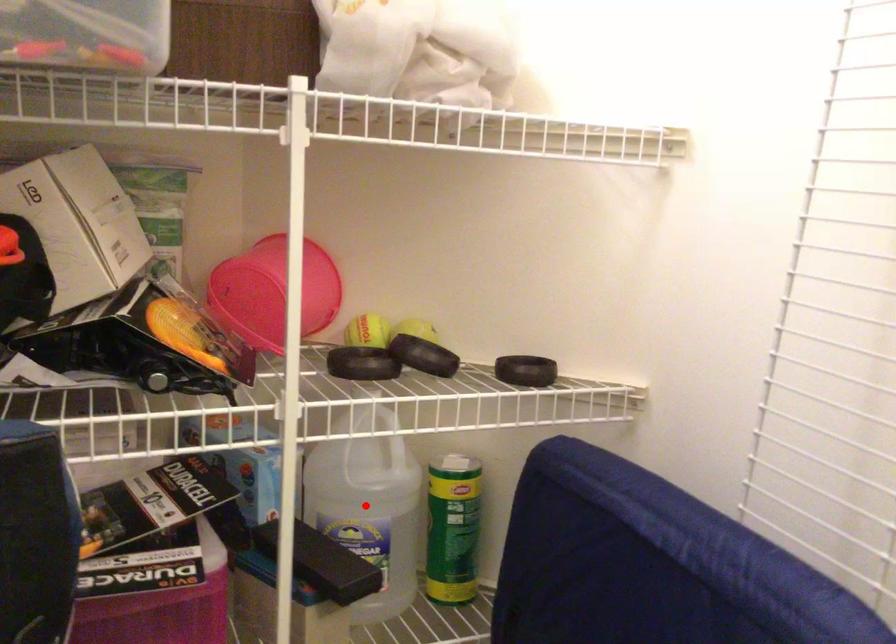
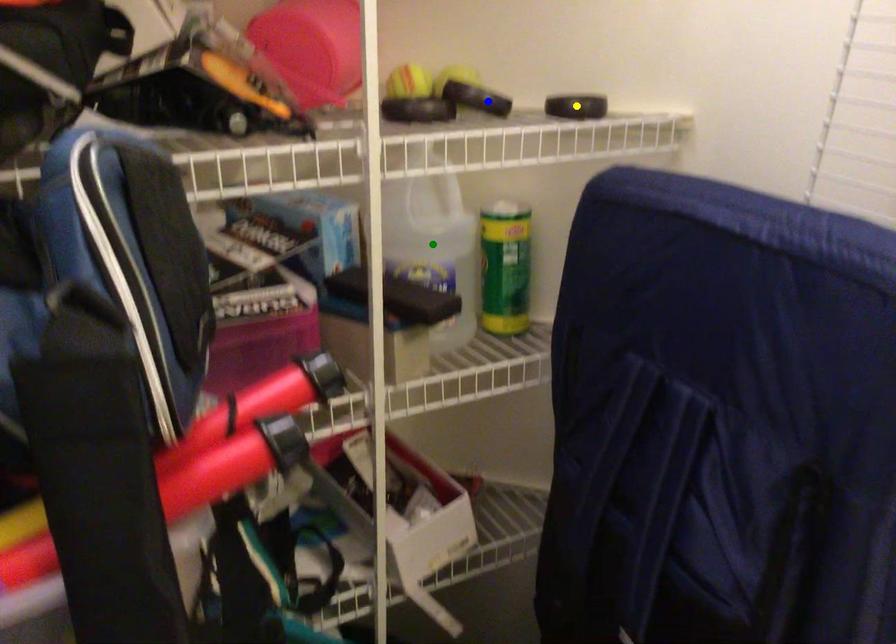
Question: I am providing you with two images of the same scene from different viewpoints. A red point is marked on the first image. You are given multiple points on the second image. Can you choose the point in image 2 that corresponds to the point in image 1?

Choices:
 (A) yellow point
 (B) green point
 (C) blue point

Answer: (B)